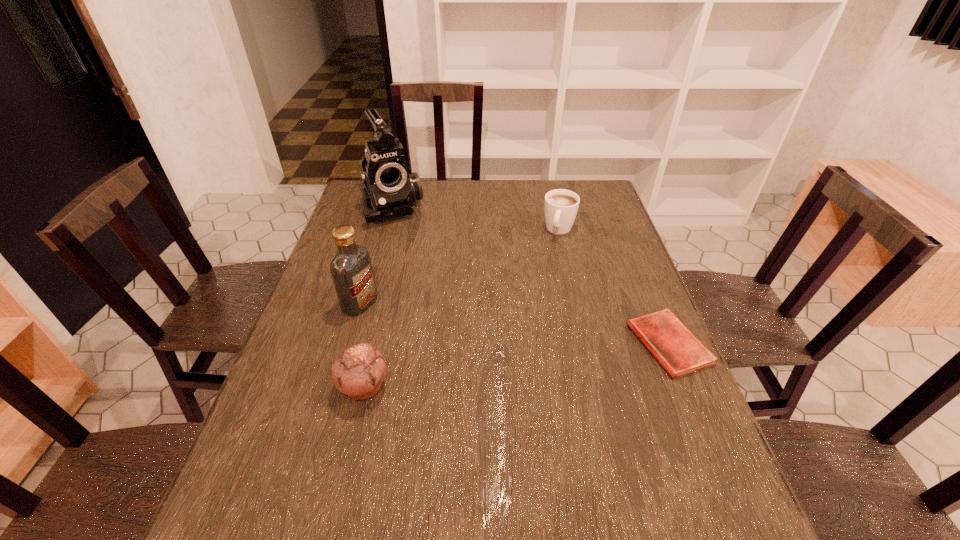
Identify the location of empty location between the diary and the muffin. This screenshot has height=540, width=960. (516, 365).

Identify the location of free spot between the muffin and the cappuccino. (462, 308).

This screenshot has width=960, height=540. In order to click on free spot between the rightmost object and the second tallest object in this screenshot , I will do `click(515, 323)`.

At what (x,y) coordinates should I click in order to perform the action: click on unoccupied area between the cappuccino and the diary. Please return your answer as a coordinate pair (x, y). This screenshot has height=540, width=960. Looking at the image, I should click on (614, 287).

Find the location of a particular element. empty space between the rightmost object and the muffin is located at coordinates (516, 365).

The image size is (960, 540). Find the location of `empty space that is in between the shortest object and the vodka`. empty space that is in between the shortest object and the vodka is located at coordinates (515, 323).

Find the location of `blank region between the fourth object from left to right and the vodka`. blank region between the fourth object from left to right and the vodka is located at coordinates (460, 267).

The width and height of the screenshot is (960, 540). What are the coordinates of `empty location between the shortest object and the muffin` in the screenshot? It's located at (516, 365).

Where is `object that can be found as the third closest to the muffin`? object that can be found as the third closest to the muffin is located at coordinates (676, 348).

Choose which object is the third nearest neighbor to the muffin. Please provide its 2D coordinates. Your answer should be formatted as a tuple, i.e. [(x, y)], where the tuple contains the x and y coordinates of a point satisfying the conditions above.

[(676, 348)]